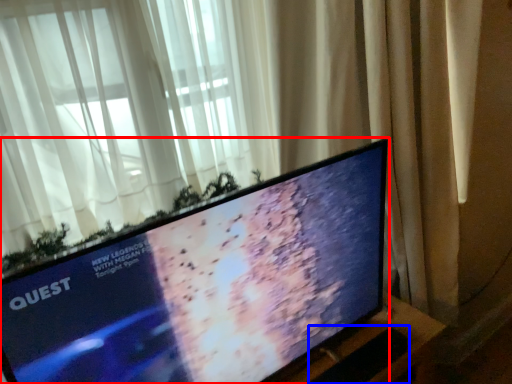
Question: Among these objects, which one is farthest to the camera, television (highlighted by a red box) or laptop keyboard (highlighted by a blue box)?

Choices:
 (A) television
 (B) laptop keyboard

Answer: (B)